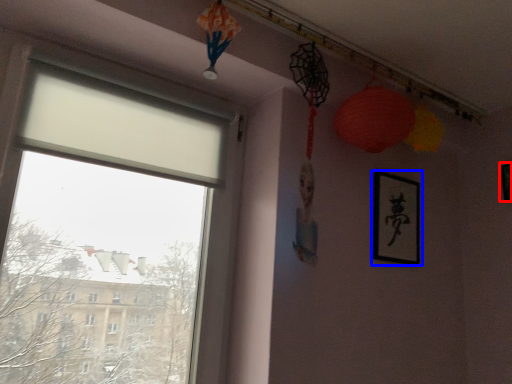
Question: Among these objects, which one is nearest to the camera, picture frame (highlighted by a red box) or picture frame (highlighted by a blue box)?

Choices:
 (A) picture frame
 (B) picture frame

Answer: (B)